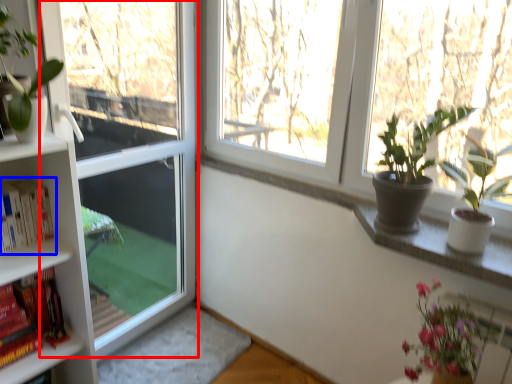
Question: Which object appears farthest to the camera in this image, screen door (highlighted by a red box) or book (highlighted by a blue box)?

Choices:
 (A) screen door
 (B) book

Answer: (A)